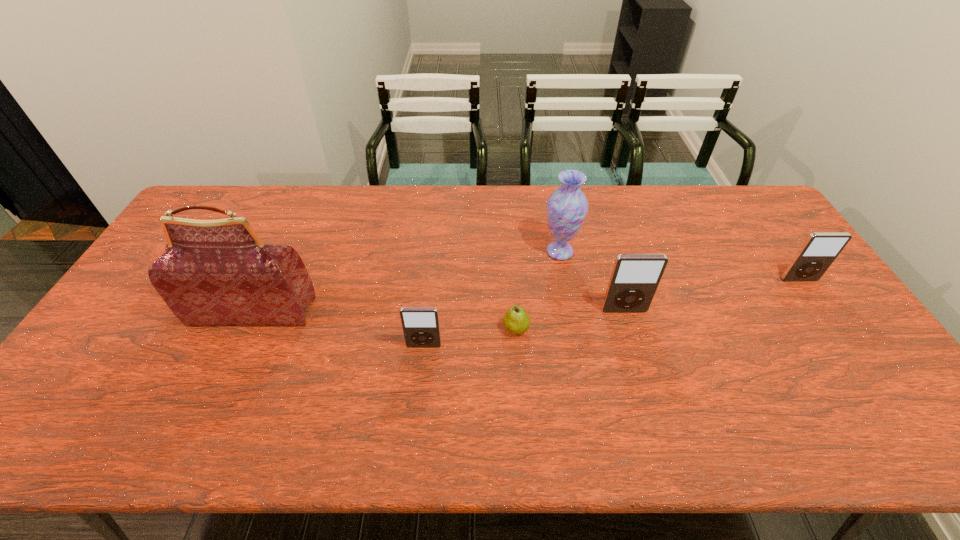
Please point a spot on the left to add another iPod. Please provide its 2D coordinates. Your answer should be formatted as a tuple, i.e. [(x, y)], where the tuple contains the x and y coordinates of a point satisfying the conditions above.

[(193, 387)]